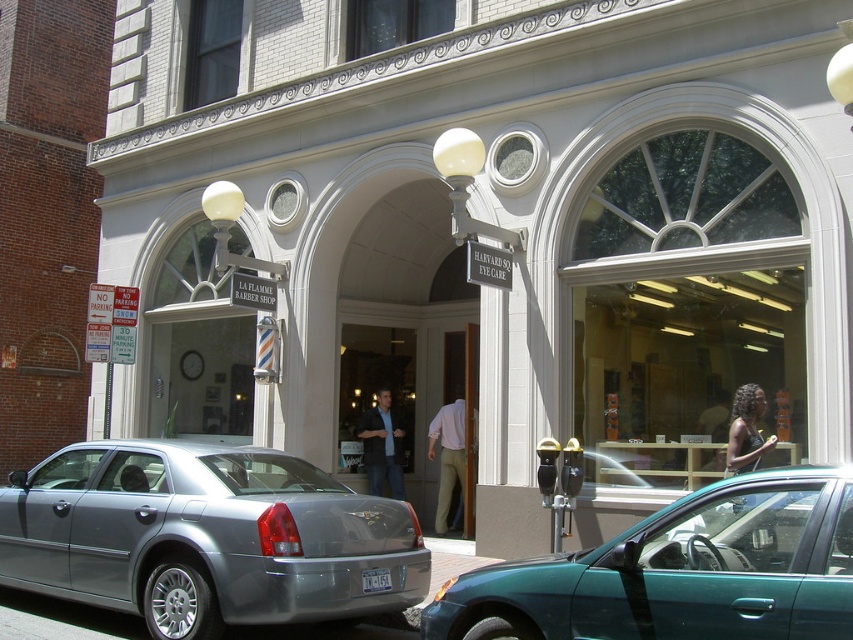
You are a delivery person trying to enter the LA FLAMME BARBER SHOP. You see two doors at the center of the building, a matte glass door at center and a light brown wood door at center. Which door should you use to enter the barber shop?

The matte glass door at center is larger in size than the light brown wood door at center, so you should use the matte glass door at center to enter the LA FLAMME BARBER SHOP.

You are a customer wanting to enter the LA FLAMME BARBER SHOP. You see the matte glass door at center and the light brown wood door at center. Which door should you use to enter the barber shop?

The light brown wood door at center is behind the matte glass door at center, so you should use the matte glass door at center to enter the LA FLAMME BARBER SHOP.

You are standing in front of the building and see a point at coordinates [680,572]. Which object is this point located on?

The point at coordinates [680,572] is located on the teal glossy car at lower right.